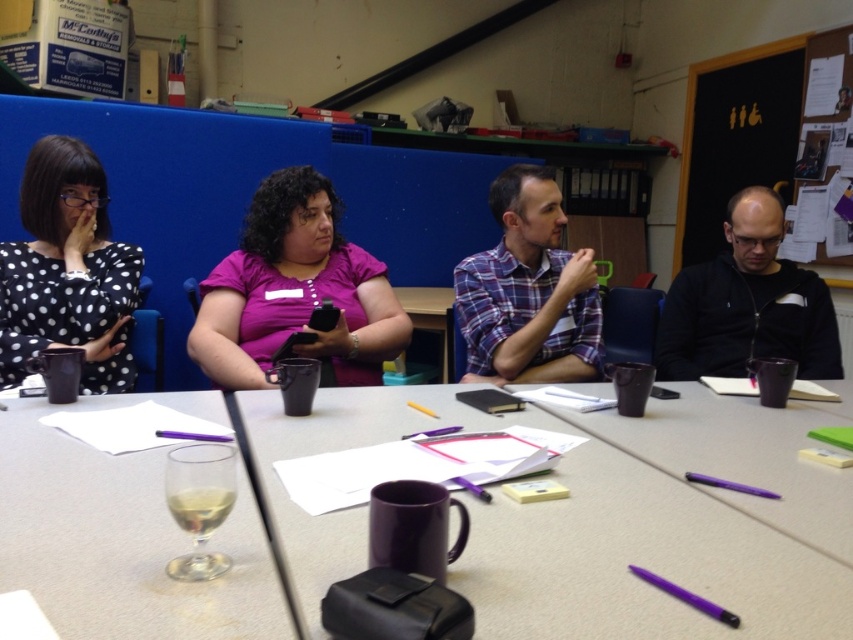
You are organizing a presentation and need to decide where to place a large poster. The black dotted dress at left is smaller than the blackboard at right. Considering their sizes, which object would be more suitable for mounting the poster on?

The blackboard at right is larger than the black dotted dress at left, so the poster should be mounted on the blackboard at right.

You are a guest at this meeting and want to pour yourself a drink. The clear glass at lower left and the black dotted dress at left are both on the table. Which object is bigger and better suited for holding liquid?

The clear glass at lower left is larger in size than the black dotted dress at left, so it is better suited for holding liquid.

You are attending a meeting in this room and need to place your notebook on a flat surface. Which object between the matte black mug at center and the blackboard at right would be more suitable for placing your notebook?

The blackboard at right is a more suitable surface for placing your notebook because the matte black mug at center is below it and likely too small or not flat enough.